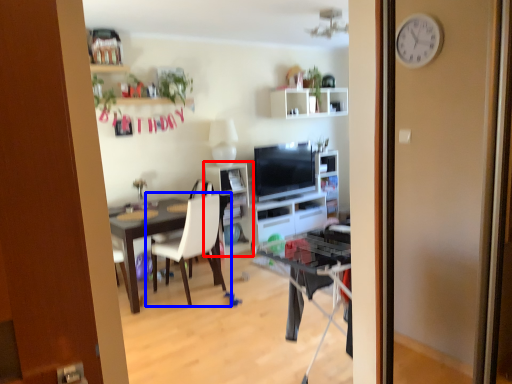
Question: Which object is closer to the camera taking this photo, shelf (highlighted by a red box) or chair (highlighted by a blue box)?

Choices:
 (A) shelf
 (B) chair

Answer: (B)